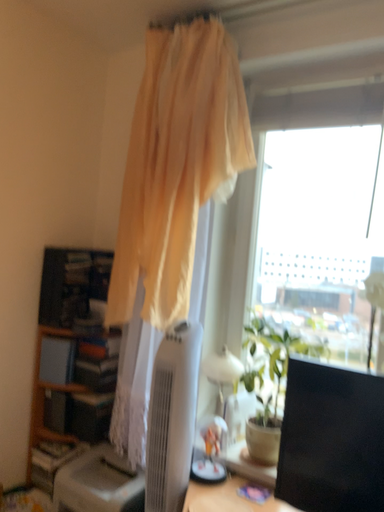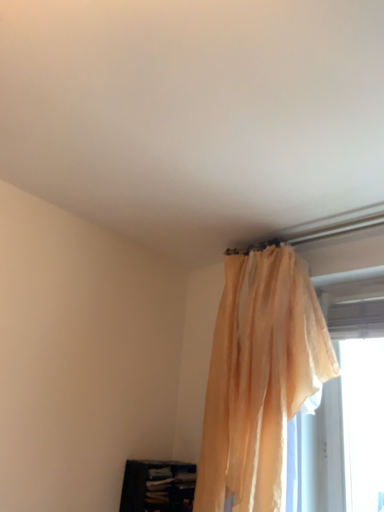
Question: How did the camera likely rotate when shooting the video?

Choices:
 (A) rotated upward
 (B) rotated downward

Answer: (A)